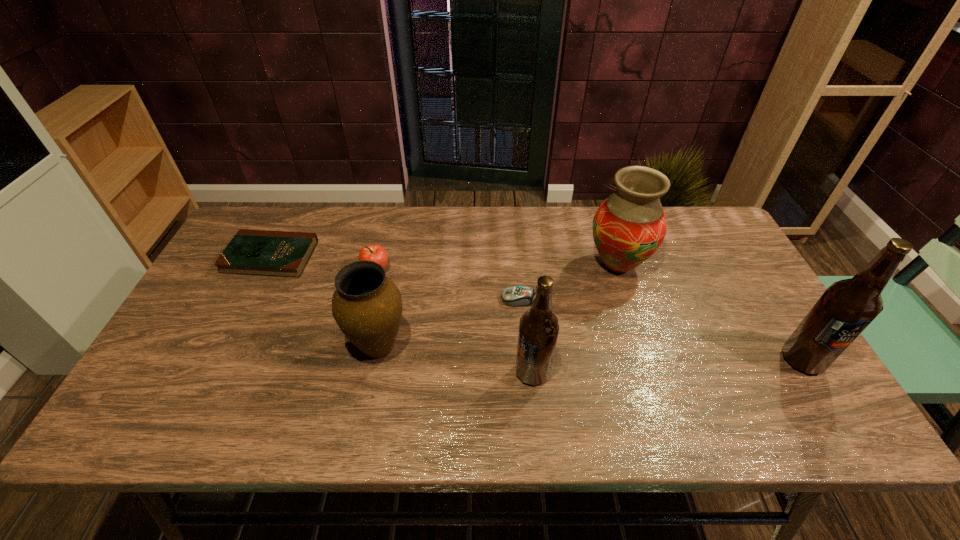
The width and height of the screenshot is (960, 540). What are the coordinates of `Bible that is at the far edge` in the screenshot? It's located at (250, 252).

Identify the location of urn that is at the near edge. (367, 306).

You are a GUI agent. You are given a task and a screenshot of the screen. Output one action in this format:
    pyautogui.click(x=<x>, y=<y>)
    Task: Click on the object present at the left edge
    The image size is (960, 540).
    Given the screenshot: What is the action you would take?
    pyautogui.click(x=250, y=252)

Identify the location of object situated at the right edge. (847, 307).

Identify the location of object that is at the far left corner. (250, 252).

Locate an element on the screen. object that is at the near right corner is located at coordinates click(x=847, y=307).

In the image, there is a desktop. Where is `vacant space at the far edge`? Image resolution: width=960 pixels, height=540 pixels. vacant space at the far edge is located at coordinates (570, 231).

Find the location of a particular element. vacant space at the near edge of the desktop is located at coordinates (402, 380).

Locate an element on the screen. The height and width of the screenshot is (540, 960). vacant space at the right edge is located at coordinates (735, 321).

What are the coordinates of `free location at the far left corner of the desktop` in the screenshot? It's located at (278, 230).